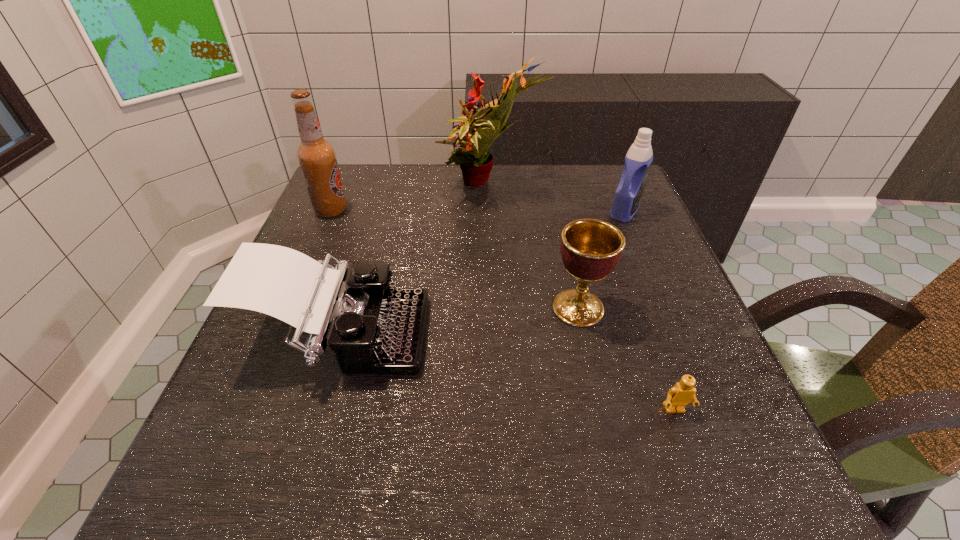
The width and height of the screenshot is (960, 540). I want to click on vacant space that satisfies the following two spatial constraints: 1. on the front-facing side of the bouquet; 2. on the back side of the third tallest object, so click(491, 211).

Identify the location of vacant region that satisfies the following two spatial constraints: 1. on the back side of the detergent; 2. on the front-facing side of the bouquet. (614, 187).

Image resolution: width=960 pixels, height=540 pixels. What are the coordinates of `free space in the image that satisfies the following two spatial constraints: 1. on the front-facing side of the chalice; 2. on the right side of the bouquet` in the screenshot? It's located at (494, 308).

Locate an element on the screen. Image resolution: width=960 pixels, height=540 pixels. blank area in the image that satisfies the following two spatial constraints: 1. on the front-facing side of the bouquet; 2. on the left side of the chalice is located at coordinates (494, 308).

Identify the location of vacant area in the image that satisfies the following two spatial constraints: 1. on the back side of the chalice; 2. on the front-facing side of the bouquet. (551, 187).

Find the location of a particular element. This screenshot has width=960, height=540. vacant area in the image that satisfies the following two spatial constraints: 1. on the front-facing side of the bouquet; 2. on the right side of the chalice is located at coordinates (494, 308).

The height and width of the screenshot is (540, 960). Identify the location of free location that satisfies the following two spatial constraints: 1. on the front-facing side of the bouquet; 2. on the left side of the third tallest object. coord(491,211).

You are a GUI agent. You are given a task and a screenshot of the screen. Output one action in this format:
    pyautogui.click(x=<x>, y=<y>)
    Task: Click on the vacant area that satisfies the following two spatial constraints: 1. on the front label of the beer bottle; 2. on the back side of the chalice
    Image resolution: width=960 pixels, height=540 pixels.
    Given the screenshot: What is the action you would take?
    pyautogui.click(x=289, y=308)